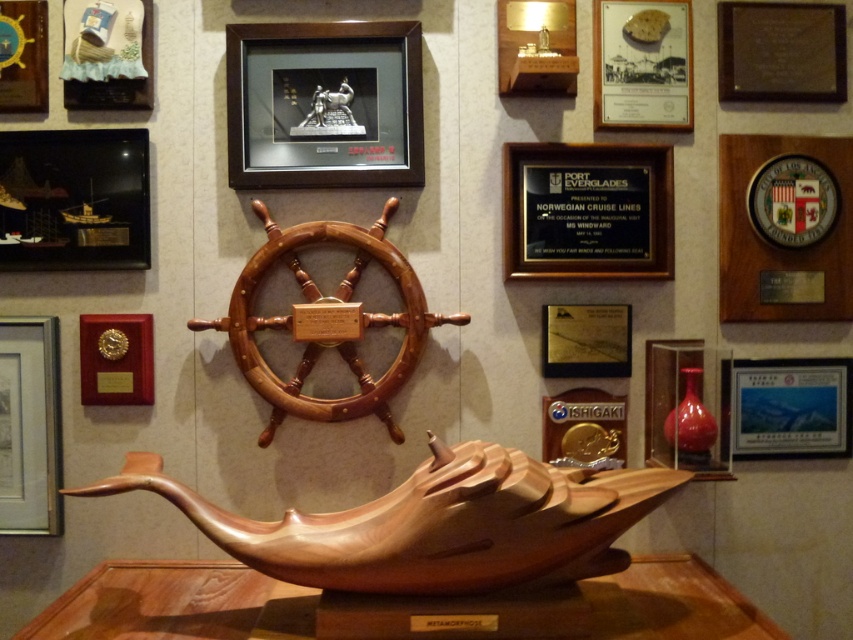
You are an interior designer planning to add a new decorative item to the maritime display. The black plaque at upper center and the matte red vase at right are already present. Which of these two items is wider?

The black plaque at upper center is wider than the matte red vase at right.

You are an interior designer arranging a maritime themed wall. You have the wooden polished at center and the brushed metal picture frame at upper left. Which object is positioned to the right of the other?

The wooden polished at center is to the right of the brushed metal picture frame at upper left.